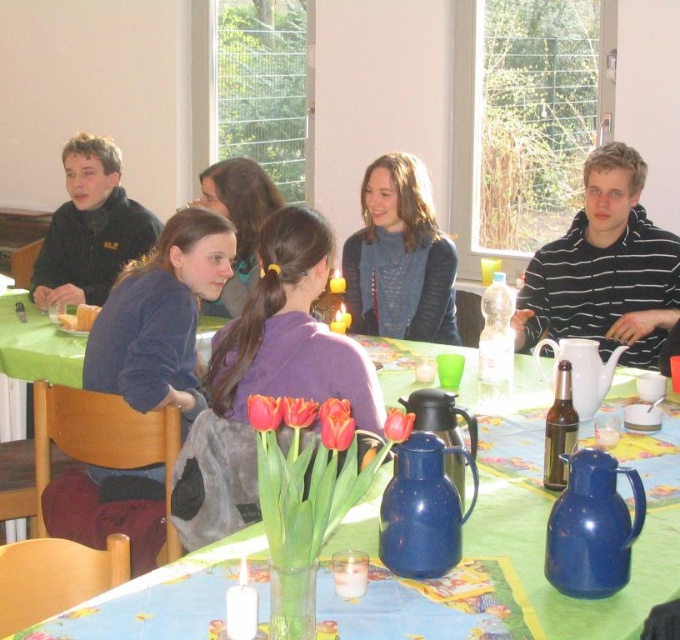
You are a guest at this table and want to pour yourself a drink. The blue ceramic jugs at center contain water, while the blue enamel thermos at center has hot tea. If you want cold water, which item should you reach for, and is it located to the left or right of the thermos?

You should reach for the blue ceramic jugs at center, which are located to the right of the blue enamel thermos at center. Since they contain cold water, that is the correct choice.

You are a guest at this table and want to pour yourself a drink. Which thermos at the center of the table is larger, the blue enamel thermos at center or the blue ceramic thermos at center?

The blue ceramic thermos at center is larger than the blue enamel thermos at center.

Consider the image. You are a guest at this table and want to grab the blue plastic thermos at lower right. Which direction should you move relative to the blue ceramic jugs at center?

The blue plastic thermos at lower right is to the right of the blue ceramic jugs at center, so you should move to the right to grab it.